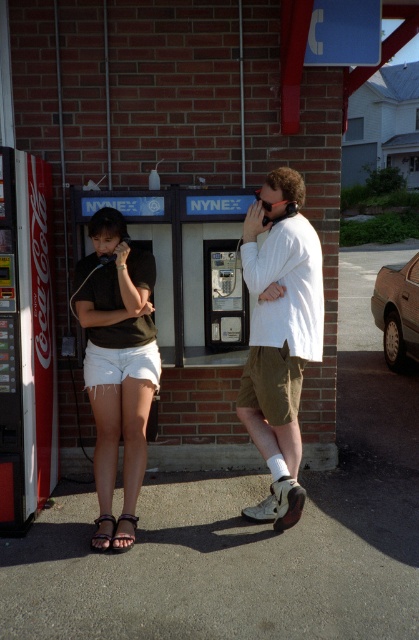
Question: Considering the real-world distances, which object is farthest from the black leather sandal at lower left?

Choices:
 (A) denim shorts at left
 (B) brown leather sandal at lower left

Answer: (A)

Question: Which object is the closest to the brown leather sandal at lower left?

Choices:
 (A) white cotton shirt at center
 (B) denim shorts at left
 (C) black leather sandal at lower left

Answer: (C)

Question: In this image, where is white cotton shirt at center located relative to denim shorts at left?

Choices:
 (A) above
 (B) below

Answer: (A)

Question: Which of these objects is positioned closest to the brown leather sandal at lower left?

Choices:
 (A) denim shorts at left
 (B) black leather sandal at lower left
 (C) white cotton shorts at center
 (D) white cotton shirt at center

Answer: (B)

Question: Is white cotton shorts at center closer to camera compared to brown leather sandal at lower left?

Choices:
 (A) yes
 (B) no

Answer: (B)

Question: Can you confirm if denim shorts at left is bigger than brown leather sandal at lower left?

Choices:
 (A) no
 (B) yes

Answer: (B)